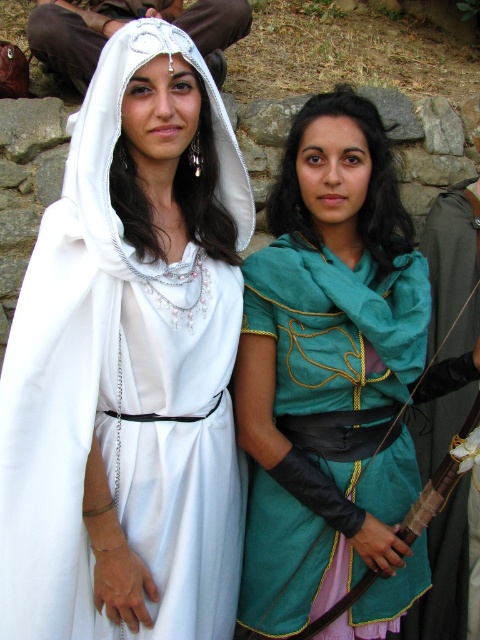
Is teal fabric dress at center positioned in front of teal satin tunic at center?

Yes, teal fabric dress at center is in front of teal satin tunic at center.

In order to click on teal fabric dress at center in this screenshot , I will do `click(331, 378)`.

Who is more forward, (x=248, y=340) or (x=453, y=348)?

Point (x=248, y=340) is in front.

At what (x,y) coordinates should I click in order to perform the action: click on teal fabric dress at center. Please return your answer as a coordinate pair (x, y). This screenshot has width=480, height=640. Looking at the image, I should click on pyautogui.click(x=331, y=378).

Is matte white dress at center positioned at the back of teal satin tunic at center?

No, it is not.

Does matte white dress at center have a greater width compared to teal satin tunic at center?

Indeed, matte white dress at center has a greater width compared to teal satin tunic at center.

The width and height of the screenshot is (480, 640). In order to click on matte white dress at center in this screenshot , I will do `click(130, 364)`.

Looking at this image, which is more to the right, teal satin tunic at center or white satin headdress at upper center?

teal satin tunic at center is more to the right.

Does teal satin tunic at center appear on the left side of white satin headdress at upper center?

In fact, teal satin tunic at center is to the right of white satin headdress at upper center.

Locate an element on the screen. The height and width of the screenshot is (640, 480). teal satin tunic at center is located at coordinates (451, 253).

Identify the location of teal satin tunic at center. (451, 253).